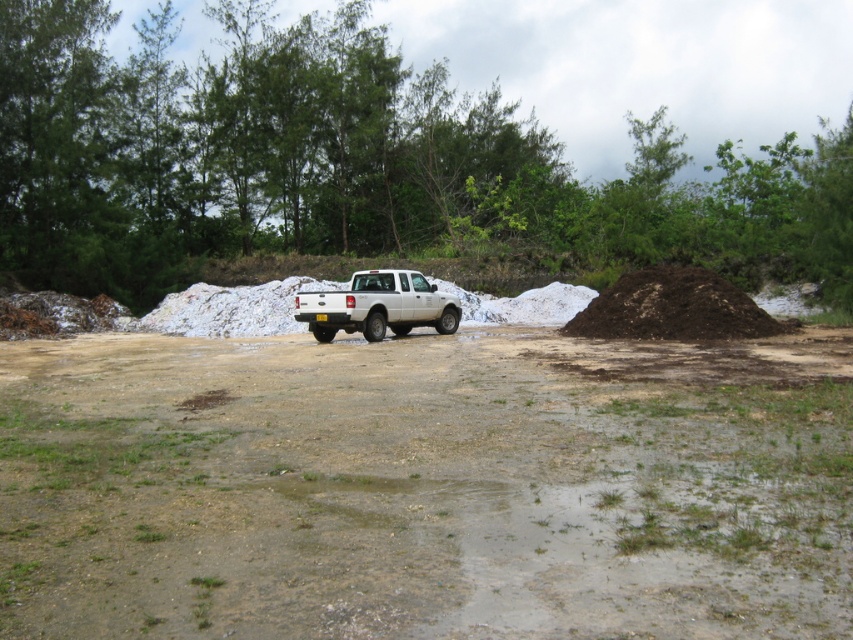
Who is more distant from viewer, (251, 628) or (665, 328)?

The point (665, 328) is behind.

Which of these two, dull brown dirt at center or dark brown soil at right, stands taller?

Standing taller between the two is dark brown soil at right.

Measure the distance between dull brown dirt at center and camera.

The distance of dull brown dirt at center from camera is 3.68 meters.

Locate an element on the screen. This screenshot has height=640, width=853. dull brown dirt at center is located at coordinates (409, 493).

Is dull brown dirt at center smaller than white matte truck at center?

Incorrect, dull brown dirt at center is not smaller in size than white matte truck at center.

Who is taller, dull brown dirt at center or white matte truck at center?

With more height is dull brown dirt at center.

What do you see at coordinates (409, 493) in the screenshot? I see `dull brown dirt at center` at bounding box center [409, 493].

At what (x,y) coordinates should I click in order to perform the action: click on dull brown dirt at center. Please return your answer as a coordinate pair (x, y). Looking at the image, I should click on (409, 493).

From the picture: Does green leafy tree at upper center have a larger size compared to dark brown soil at right?

Yes.

What do you see at coordinates (352, 163) in the screenshot? Image resolution: width=853 pixels, height=640 pixels. I see `green leafy tree at upper center` at bounding box center [352, 163].

Image resolution: width=853 pixels, height=640 pixels. I want to click on green leafy tree at upper center, so click(352, 163).